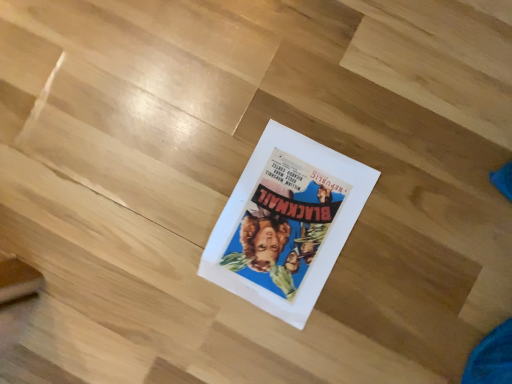
This screenshot has width=512, height=384. I want to click on vacant space underneath white paper poster at center (from a real-world perspective), so click(286, 222).